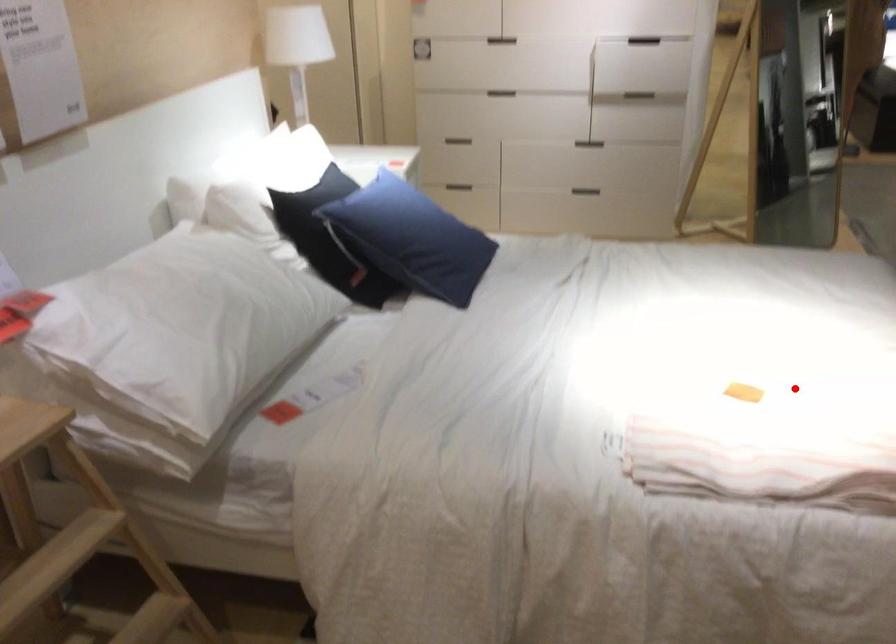
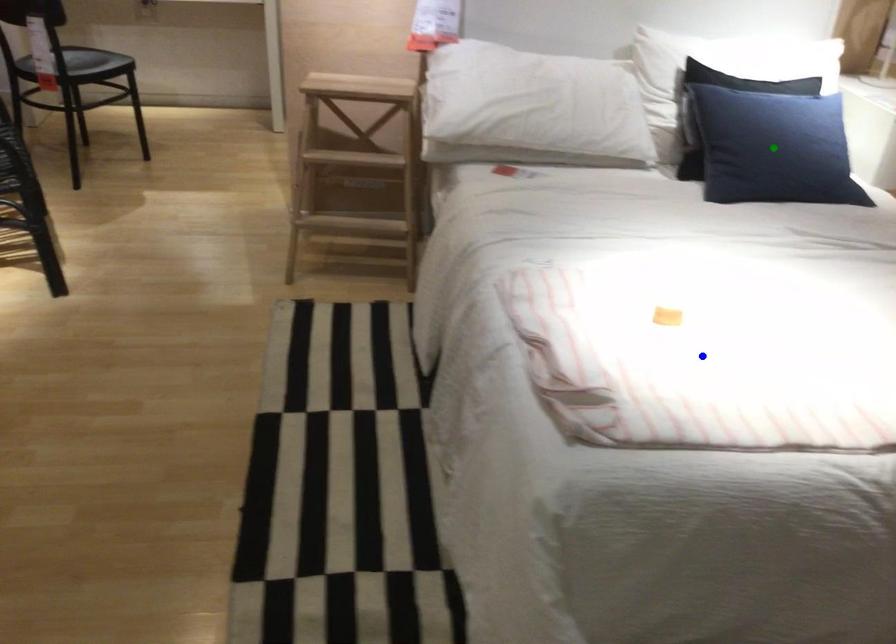
Question: I am providing you with two images of the same scene from different viewpoints. A red point is marked on the first image. You are given multiple points on the second image. Which point in image 2 represents the same 3d spot as the red point in image 1?

Choices:
 (A) yellow point
 (B) green point
 (C) blue point

Answer: (C)